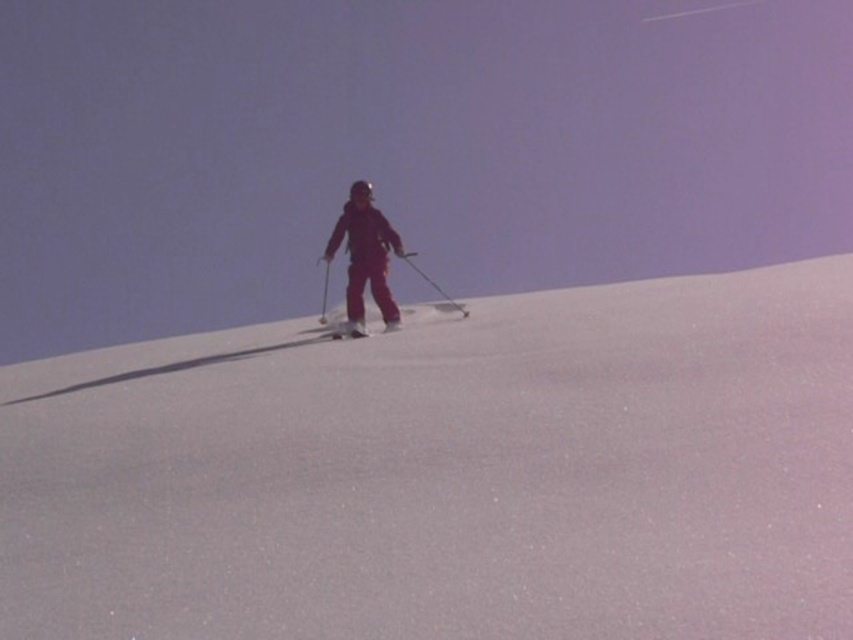
You are a photographer trying to capture a closeup shot of the white powder snow at center and the matte red ski suit at center. Given that your camera can only focus on one object at a time, which object should you focus on to ensure it fills more of the frame?

The white powder snow at center is larger in size than the matte red ski suit at center, so focusing on the white powder snow at center will fill more of the frame.